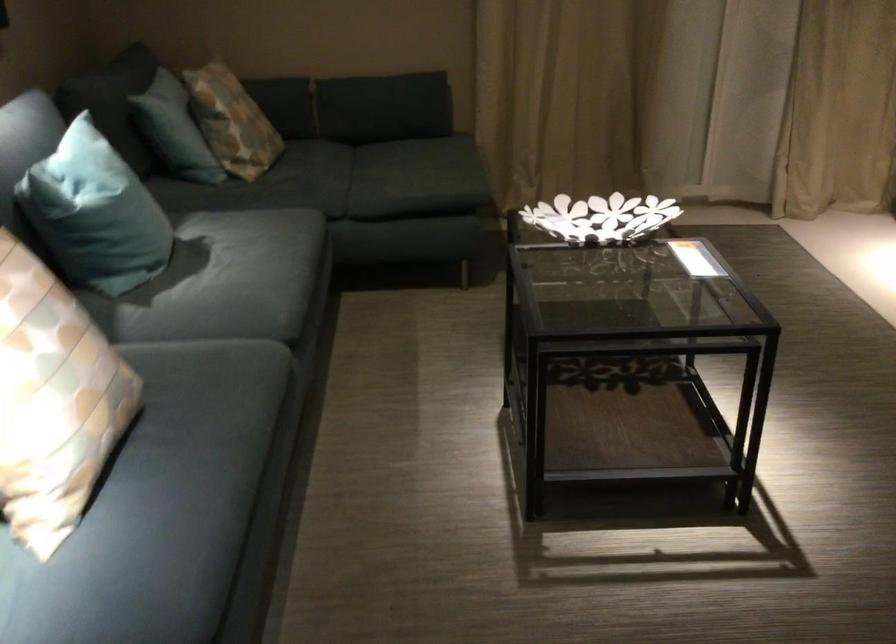
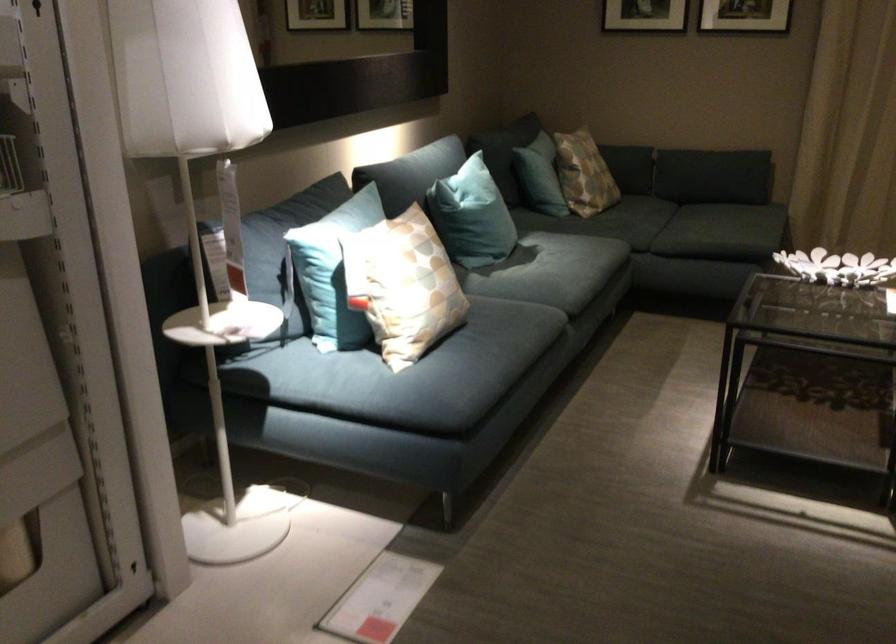
Locate, in the second image, the point that corresponds to pixel 590 234 in the first image.

(837, 267)